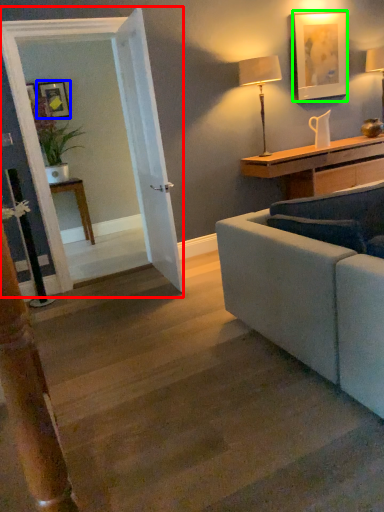
Question: Which object is the farthest from glass door (highlighted by a red box)? Choose among these: picture frame (highlighted by a blue box) or picture frame (highlighted by a green box).

Choices:
 (A) picture frame
 (B) picture frame

Answer: (A)